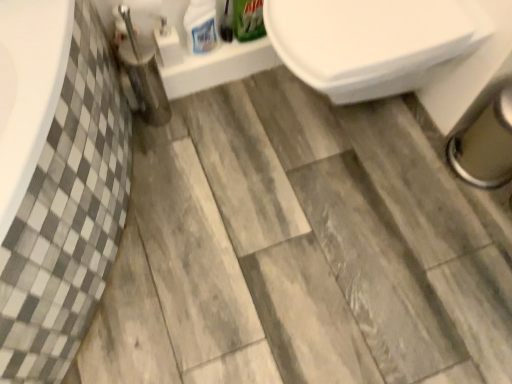
This screenshot has width=512, height=384. What are the coordinates of `free space that is to the left of white glossy toilet at upper right` in the screenshot? It's located at (217, 145).